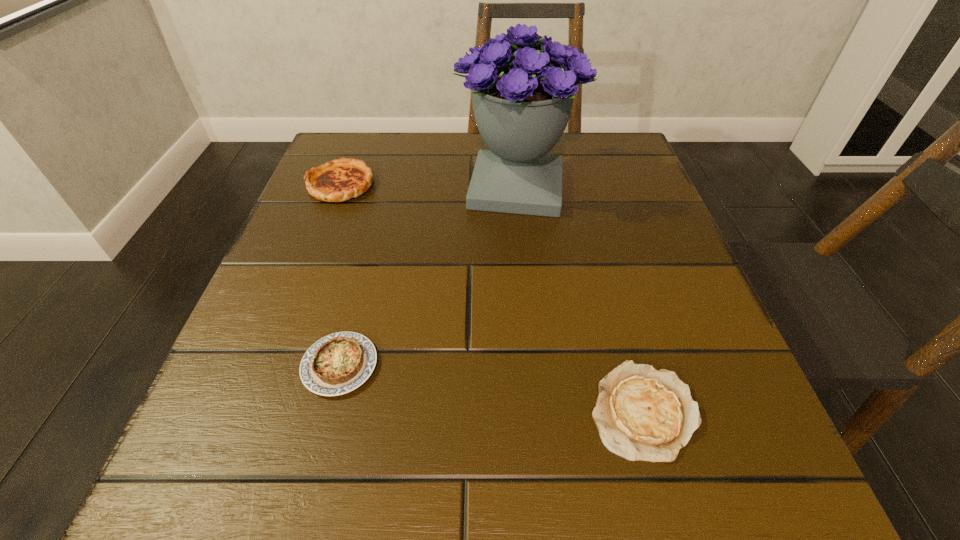
The image size is (960, 540). I want to click on bouquet that is at the right edge, so click(x=522, y=103).

At what (x,y) coordinates should I click in order to perform the action: click on quiche that is positioned at the right edge. Please return your answer as a coordinate pair (x, y). Image resolution: width=960 pixels, height=540 pixels. Looking at the image, I should click on (641, 413).

Identify the location of object at the far left corner. (339, 180).

Where is `object that is at the far right corner`? Image resolution: width=960 pixels, height=540 pixels. object that is at the far right corner is located at coordinates (522, 103).

This screenshot has height=540, width=960. Find the location of `object present at the near right corner`. object present at the near right corner is located at coordinates (641, 413).

At what (x,y) coordinates should I click in order to perform the action: click on vacant region at the far edge. Please return your answer as a coordinate pair (x, y). This screenshot has width=960, height=540. Looking at the image, I should click on [x=449, y=160].

Identify the location of vacant area at the near edge of the desktop. Image resolution: width=960 pixels, height=540 pixels. (410, 479).

Find the location of a particular element. This screenshot has height=540, width=960. vacant space at the left edge of the desktop is located at coordinates (309, 205).

Find the location of a particular element. The height and width of the screenshot is (540, 960). free location at the right edge is located at coordinates (658, 205).

Identify the location of vacant area at the far left corner of the desktop. (378, 132).